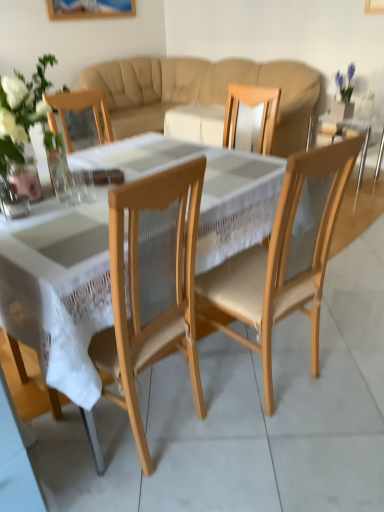
I want to click on free spot in front of natural wood chair at center, so click(x=274, y=453).